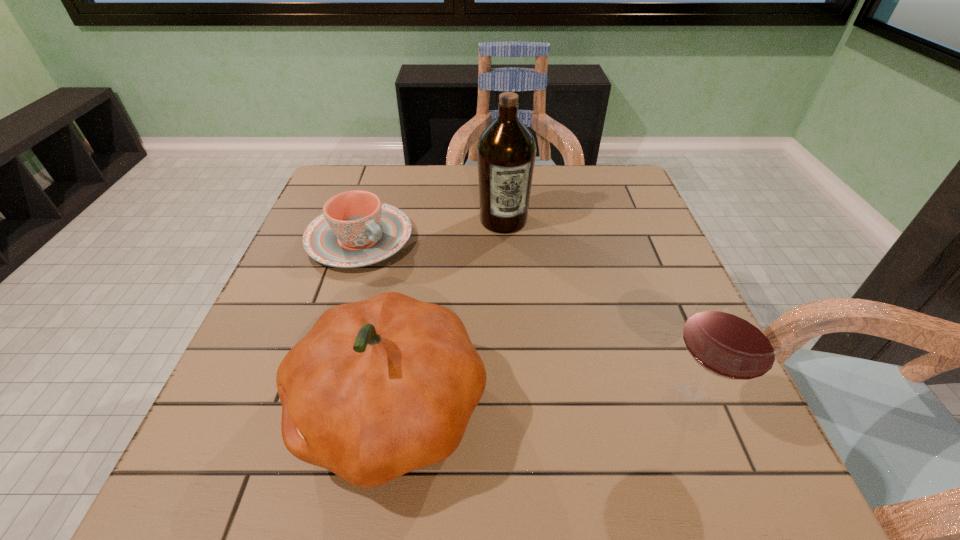
Image resolution: width=960 pixels, height=540 pixels. Find the location of `vacant space located on the label of the olive oil`. vacant space located on the label of the olive oil is located at coordinates (519, 273).

You are a GUI agent. You are given a task and a screenshot of the screen. Output one action in this format:
    pyautogui.click(x=<x>, y=<y>)
    Task: Click on the chinaware that is at the far edge
    
    Given the screenshot: What is the action you would take?
    pyautogui.click(x=356, y=229)

I want to click on olive oil present at the far edge, so click(506, 151).

I want to click on pumpkin situated at the near edge, so click(377, 388).

Find the location of a particular element. wineglass situated at the near edge is located at coordinates (731, 335).

This screenshot has height=540, width=960. In order to click on pumpkin that is positioned at the left edge in this screenshot , I will do `click(377, 388)`.

Identify the location of chinaware that is at the left edge. (356, 229).

You are a GUI agent. You are given a task and a screenshot of the screen. Output one action in this format:
    pyautogui.click(x=<x>, y=<y>)
    Task: Click on the object that is at the right edge
    The width and height of the screenshot is (960, 540).
    Given the screenshot: What is the action you would take?
    pyautogui.click(x=731, y=335)

Locate an element on the screen. object that is at the far left corner is located at coordinates (356, 229).

This screenshot has height=540, width=960. In order to click on object present at the near left corner in this screenshot , I will do tap(377, 388).